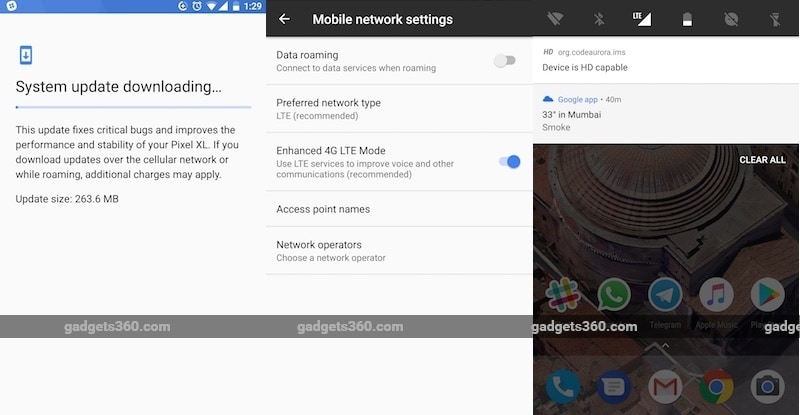
Where is `toggle switch`? Image resolution: width=800 pixels, height=415 pixels. toggle switch is located at coordinates (504, 160), (506, 58).